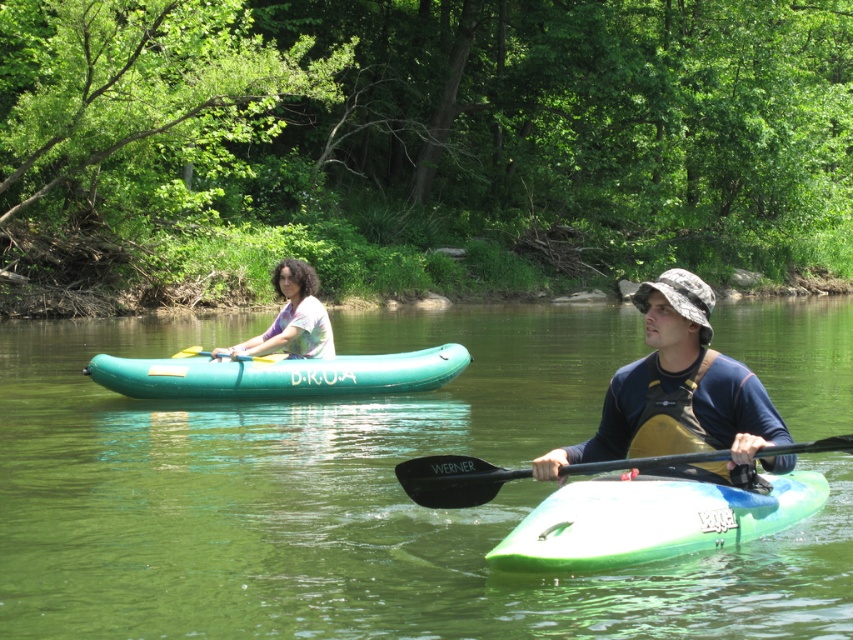
Question: Is teal rubber canoe at center further to camera compared to black rubber paddle at upper center?

Choices:
 (A) yes
 (B) no

Answer: (B)

Question: Which point is closer to the camera?

Choices:
 (A) (583, 324)
 (B) (194, 355)
 (C) (602, 493)

Answer: (C)

Question: Which object is farther from the camera taking this photo?

Choices:
 (A) green plastic kayak at center
 (B) camouflage fabric hat at center
 (C) black rubber paddle at center
 (D) black rubber paddle at upper center

Answer: (D)

Question: Can you confirm if green rubber kayak at center is positioned to the right of green plastic kayak at center?

Choices:
 (A) no
 (B) yes

Answer: (B)

Question: Which of these objects is positioned farthest from the black rubber paddle at center?

Choices:
 (A) green rubber kayak at center
 (B) black rubber paddle at upper center
 (C) teal rubber canoe at center
 (D) matte tie-dye shirt at center

Answer: (A)

Question: Can you confirm if green rubber kayak at center is thinner than black rubber paddle at center?

Choices:
 (A) no
 (B) yes

Answer: (A)